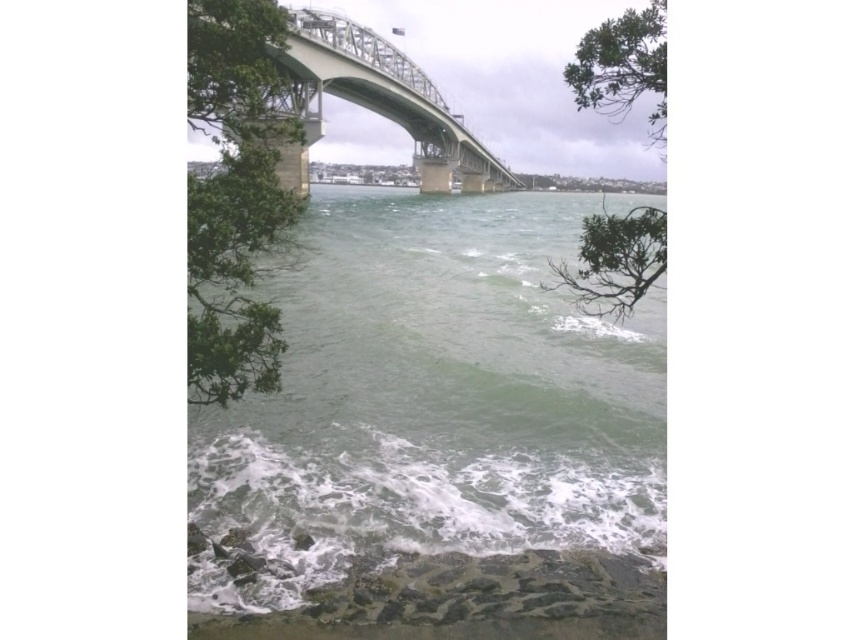
Question: Can you confirm if green leafy tree at upper left is smaller than green leafy branch at upper right?

Choices:
 (A) no
 (B) yes

Answer: (B)

Question: Which of these objects is positioned farthest from the steel bridge at center?

Choices:
 (A) green leafy tree at upper left
 (B) greenish water at center
 (C) green leafy branch at upper right
 (D) green leafy tree at upper right

Answer: (D)

Question: Does green leafy tree at upper left lie behind green leafy tree at upper right?

Choices:
 (A) yes
 (B) no

Answer: (B)

Question: Which point is closer to the camera taking this photo?

Choices:
 (A) (392, 100)
 (B) (651, 144)
 (C) (589, 99)
 (D) (254, 145)

Answer: (C)

Question: Can you confirm if greenish water at center is positioned to the right of green leafy tree at upper right?

Choices:
 (A) yes
 (B) no

Answer: (B)

Question: Which point is farther to the camera?

Choices:
 (A) green leafy tree at upper right
 (B) steel bridge at center
 (C) greenish water at center
 (D) green leafy branch at upper right

Answer: (B)